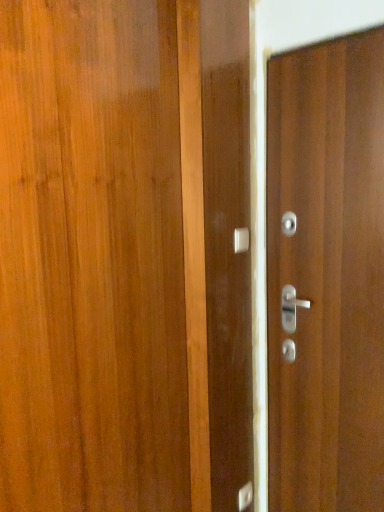
Question: From the image's perspective, is wooden door at right positioned above or below satin silver door handle at center, the first door handle in the top-to-bottom sequence?

Choices:
 (A) above
 (B) below

Answer: (B)

Question: In the image, is wooden door at right on the left side or the right side of satin silver door handle at center, the 1th door handle from the front?

Choices:
 (A) right
 (B) left

Answer: (A)

Question: Which is nearer to the wooden door at right?

Choices:
 (A) satin silver door handle at center, the second door handle viewed from the top
 (B) satin silver door handle at center, the 1th door handle from the front

Answer: (B)

Question: Which object is the farthest from the satin silver door handle at center, placed as the 2th door handle when sorted from front to back?

Choices:
 (A) wooden door at right
 (B) satin silver door handle at center, the 2th door handle ordered from the bottom

Answer: (B)